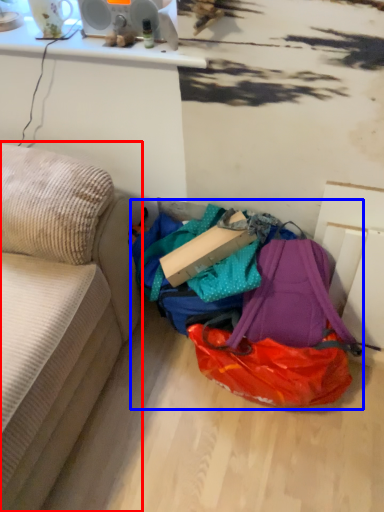
Question: Which object appears closest to the camera in this image, studio couch (highlighted by a red box) or bag (highlighted by a blue box)?

Choices:
 (A) studio couch
 (B) bag

Answer: (A)